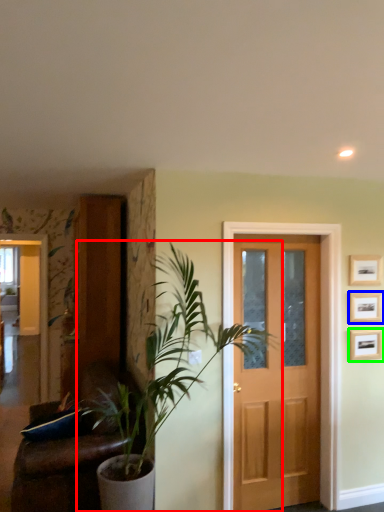
Question: Estimate the real-world distances between objects in this image. Which object is closer to houseplant (highlighted by a red box), picture frame (highlighted by a blue box) or picture frame (highlighted by a green box)?

Choices:
 (A) picture frame
 (B) picture frame

Answer: (B)